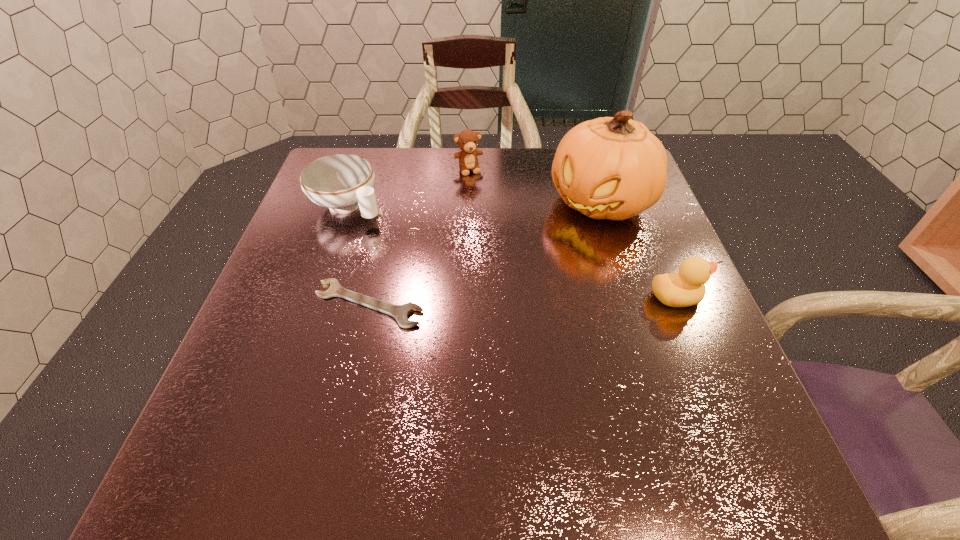
At what (x,y) coordinates should I click in order to perform the action: click on unoccupied position between the tallest object and the duckling. Please return your answer as a coordinate pair (x, y). Looking at the image, I should click on (638, 249).

This screenshot has width=960, height=540. What are the coordinates of `blank region between the shortest object and the chinaware` in the screenshot? It's located at (358, 254).

Where is `free point between the teddy bear and the tallest object`? The width and height of the screenshot is (960, 540). free point between the teddy bear and the tallest object is located at coordinates (535, 186).

Where is `empty space that is in between the shortest object and the third object from right to left`? This screenshot has height=540, width=960. empty space that is in between the shortest object and the third object from right to left is located at coordinates (419, 237).

At what (x,y) coordinates should I click in order to perform the action: click on free spot between the duckling and the pumpkin. Please return your answer as a coordinate pair (x, y). This screenshot has width=960, height=540. Looking at the image, I should click on (638, 249).

Image resolution: width=960 pixels, height=540 pixels. In order to click on free space between the chinaware and the third object from right to left in this screenshot , I will do `click(408, 187)`.

This screenshot has width=960, height=540. In order to click on vacant area that lies between the duckling and the chinaware in this screenshot , I will do (x=512, y=251).

At what (x,y) coordinates should I click in order to perform the action: click on free space between the pumpkin and the wrench. Please return your answer as a coordinate pair (x, y). The width and height of the screenshot is (960, 540). Looking at the image, I should click on (485, 253).

The image size is (960, 540). Identify the location of free spot between the shortest object and the pumpkin. (485, 253).

The image size is (960, 540). I want to click on object that is the closest one to the chinaware, so click(x=467, y=140).